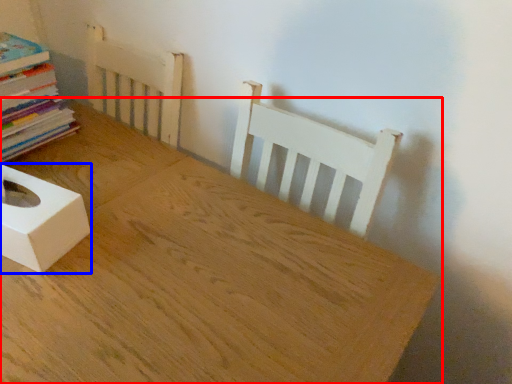
Question: Which object appears closest to the camera in this image, table (highlighted by a red box) or box (highlighted by a blue box)?

Choices:
 (A) table
 (B) box

Answer: (A)